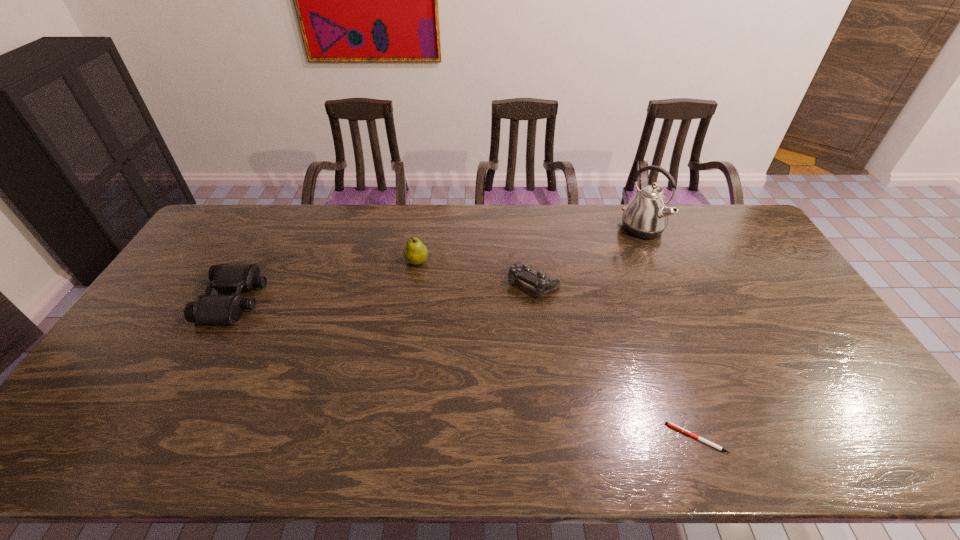
This screenshot has height=540, width=960. I want to click on free region at the near edge, so click(x=567, y=454).

In the image, there is a desktop. Where is `vacant space at the right edge`? The width and height of the screenshot is (960, 540). vacant space at the right edge is located at coordinates (837, 394).

Locate an element on the screen. The image size is (960, 540). unoccupied area between the leftmost object and the kettle is located at coordinates (439, 265).

At what (x,y) coordinates should I click in order to perform the action: click on unoccupied area between the second tallest object and the third object from left to right. Please return your answer as a coordinate pair (x, y). This screenshot has width=960, height=540. Looking at the image, I should click on pos(475,273).

The width and height of the screenshot is (960, 540). What are the coordinates of `vacant area that lies between the third object from right to left and the pear` in the screenshot? It's located at (475, 273).

Identify the location of free space between the pen and the fourth tallest object. The height and width of the screenshot is (540, 960). (615, 361).

At what (x,y) coordinates should I click in order to perform the action: click on vacant space in between the kettle and the second object from left to right. Please return your answer as a coordinate pair (x, y). The height and width of the screenshot is (540, 960). Looking at the image, I should click on (529, 245).

Where is `free space between the second shortest object and the binoculars`? This screenshot has height=540, width=960. free space between the second shortest object and the binoculars is located at coordinates (384, 292).

The width and height of the screenshot is (960, 540). Find the location of `free space between the third object from right to left and the shortest object`. free space between the third object from right to left and the shortest object is located at coordinates (615, 361).

The image size is (960, 540). Find the location of `vacant region between the nearest object and the tallest object`. vacant region between the nearest object and the tallest object is located at coordinates (669, 333).